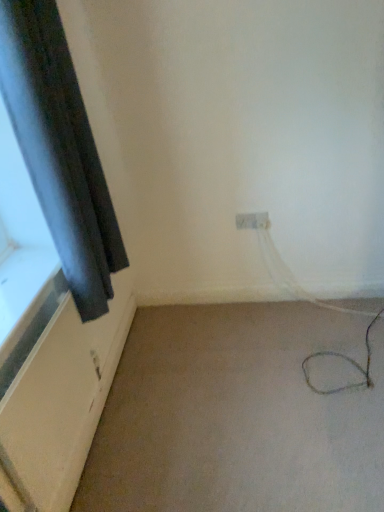
Question: From a real-world perspective, is black matte curtain at left over white plastic electric outlet at center?

Choices:
 (A) yes
 (B) no

Answer: (A)

Question: Considering the relative sizes of black matte curtain at left and white plastic electric outlet at center in the image provided, is black matte curtain at left taller than white plastic electric outlet at center?

Choices:
 (A) no
 (B) yes

Answer: (B)

Question: Is black matte curtain at left facing towards white plastic electric outlet at center?

Choices:
 (A) yes
 (B) no

Answer: (B)

Question: Is black matte curtain at left at the right side of white plastic electric outlet at center?

Choices:
 (A) no
 (B) yes

Answer: (A)

Question: Would you consider black matte curtain at left to be distant from white plastic electric outlet at center?

Choices:
 (A) no
 (B) yes

Answer: (A)

Question: Visually, is beige carpet at lower right positioned to the left or to the right of black matte curtain at left?

Choices:
 (A) right
 (B) left

Answer: (A)

Question: In terms of height, does beige carpet at lower right look taller or shorter compared to black matte curtain at left?

Choices:
 (A) tall
 (B) short

Answer: (B)

Question: Is point (299, 410) positioned closer to the camera than point (99, 282)?

Choices:
 (A) farther
 (B) closer

Answer: (A)

Question: Is beige carpet at lower right inside the boundaries of black matte curtain at left, or outside?

Choices:
 (A) outside
 (B) inside

Answer: (A)

Question: Based on their sizes in the image, would you say black matte curtain at left is bigger or smaller than white plastic electric outlet at center?

Choices:
 (A) small
 (B) big

Answer: (B)

Question: Is black matte curtain at left wider or thinner than white plastic electric outlet at center?

Choices:
 (A) wide
 (B) thin

Answer: (A)

Question: Does point (122, 245) appear closer or farther from the camera than point (256, 215)?

Choices:
 (A) farther
 (B) closer

Answer: (A)

Question: In the image, is black matte curtain at left on the left side or the right side of white plastic electric outlet at center?

Choices:
 (A) left
 (B) right

Answer: (A)

Question: From a real-world perspective, is black matte curtain at left physically located above or below beige carpet at lower right?

Choices:
 (A) above
 (B) below

Answer: (A)

Question: Does point (41, 199) appear closer or farther from the camera than point (105, 413)?

Choices:
 (A) farther
 (B) closer

Answer: (B)